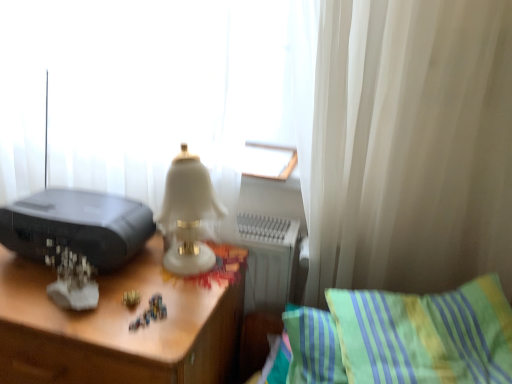
Question: In the image, is wooden desk at center on the left side or the right side of green striped pillow at lower right?

Choices:
 (A) left
 (B) right

Answer: (A)

Question: Considering their positions, is wooden desk at center located in front of or behind green striped pillow at lower right?

Choices:
 (A) front
 (B) behind

Answer: (B)

Question: Which of these objects is positioned closest to the black plastic printer at left?

Choices:
 (A) wooden desk at center
 (B) green striped pillow at lower right
 (C) white sheer curtain at upper left

Answer: (A)

Question: Which of these objects is positioned closest to the black plastic printer at left?

Choices:
 (A) wooden desk at center
 (B) green striped pillow at lower right
 (C) white sheer curtain at upper left

Answer: (A)